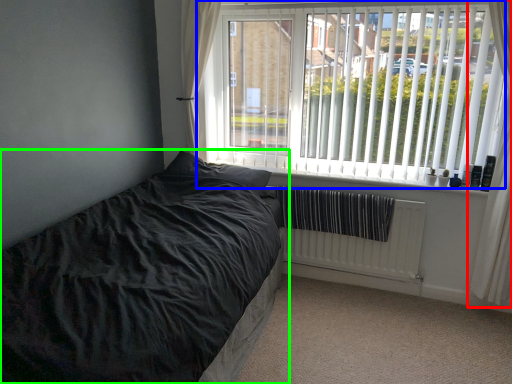
Question: Considering the real-world distances, which object is farthest from curtain (highlighted by a red box)? window (highlighted by a blue box) or bed (highlighted by a green box)?

Choices:
 (A) window
 (B) bed

Answer: (B)